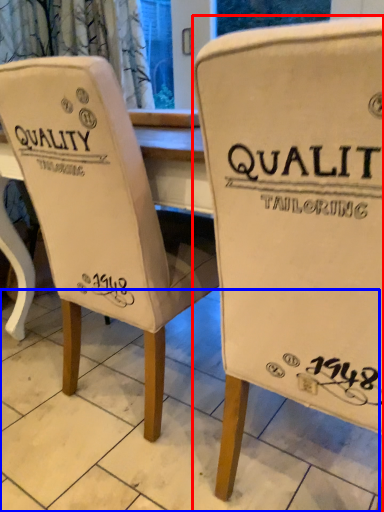
Question: Which point is further to the camera, chair (highlighted by a red box) or tile (highlighted by a blue box)?

Choices:
 (A) chair
 (B) tile

Answer: (B)